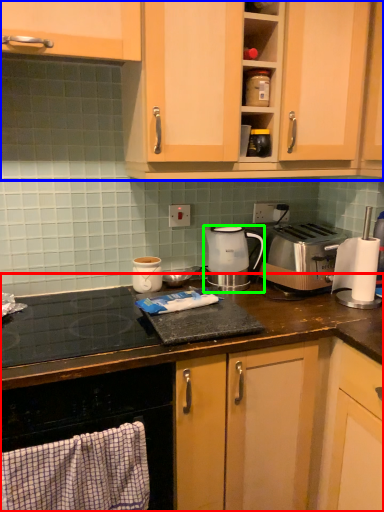
Question: Considering the real-world distances, which object is farthest from countertop (highlighted by a red box)? cabinetry (highlighted by a blue box) or kitchen appliance (highlighted by a green box)?

Choices:
 (A) cabinetry
 (B) kitchen appliance

Answer: (A)